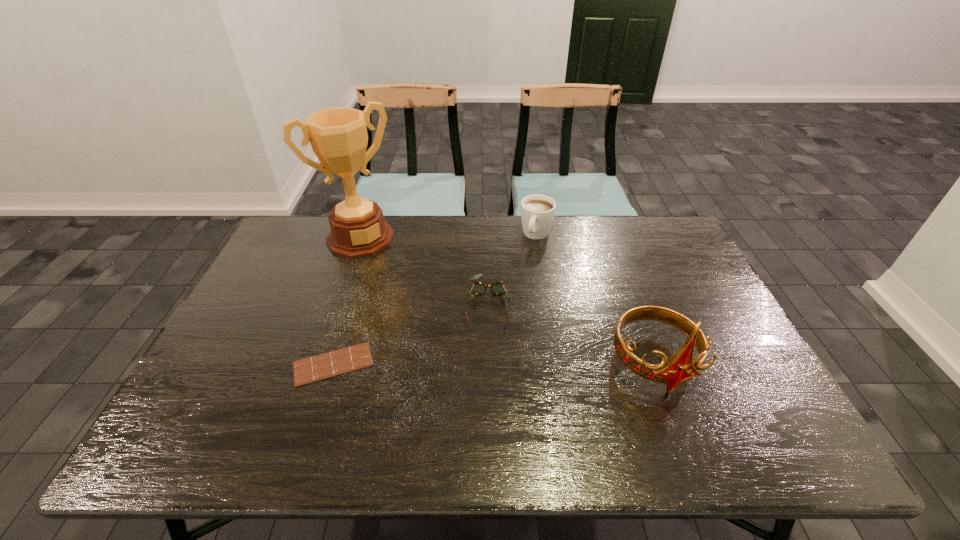
Identify the location of chocolate bar that is at the near edge. (334, 363).

Identify the location of tiara present at the near edge. The image size is (960, 540). (680, 368).

Identify the location of object located in the left edge section of the desktop. (338, 136).

Where is `object located in the right edge section of the desktop`? The image size is (960, 540). object located in the right edge section of the desktop is located at coordinates (680, 368).

This screenshot has width=960, height=540. I want to click on object that is at the far left corner, so click(338, 136).

I want to click on object that is at the near right corner, so click(x=680, y=368).

This screenshot has width=960, height=540. I want to click on vacant space at the far edge, so click(571, 215).

At what (x,y) coordinates should I click in order to perform the action: click on vacant space at the near edge. Please return your answer as a coordinate pair (x, y). The width and height of the screenshot is (960, 540). Looking at the image, I should click on (508, 406).

Where is `free spot at the left edge of the desktop`? This screenshot has height=540, width=960. free spot at the left edge of the desktop is located at coordinates (277, 294).

Find the location of a particular element. The height and width of the screenshot is (540, 960). vacant position at the right edge of the desktop is located at coordinates (721, 328).